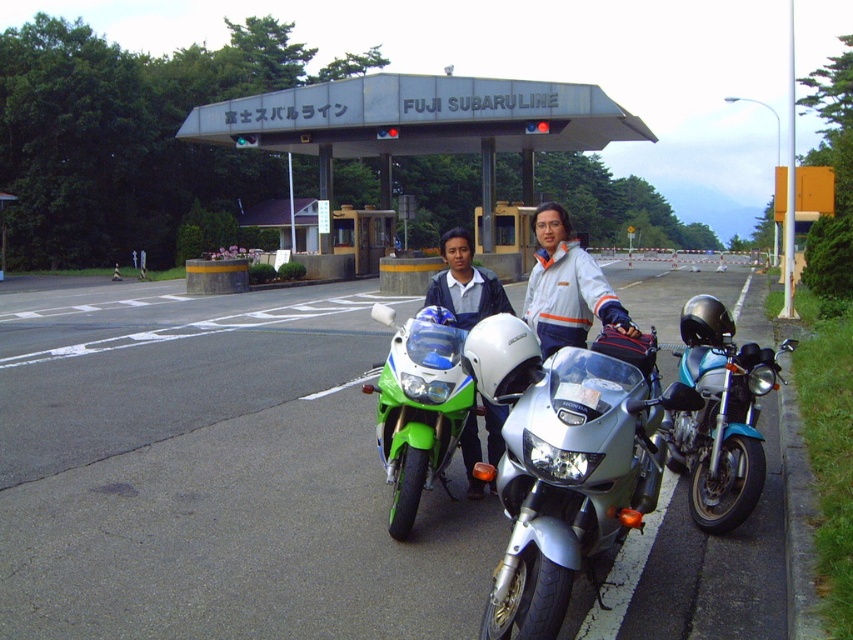
Question: Observing the image, what is the correct spatial positioning of silver metallic motorcycle at center in reference to white glossy helmet at center?

Choices:
 (A) above
 (B) below

Answer: (B)

Question: Which point is closer to the camera?

Choices:
 (A) matte blue helmet at center
 (B) green matte/satin motorcycle at center
 (C) teal metallic motorcycle at right

Answer: (A)

Question: Observing the image, what is the correct spatial positioning of silver metallic motorcycle at center in reference to white glossy helmet at center?

Choices:
 (A) below
 (B) above

Answer: (A)

Question: Which of the following is the farthest from the observer?

Choices:
 (A) (734, 408)
 (B) (543, 604)
 (C) (473, 266)

Answer: (C)

Question: Is silver metallic motorcycle at center positioned before white glossy helmet at center?

Choices:
 (A) yes
 (B) no

Answer: (A)

Question: Which object is farther from the camera taking this photo?

Choices:
 (A) green matte/satin motorcycle at center
 (B) teal metallic motorcycle at right
 (C) white glossy helmet at center

Answer: (B)